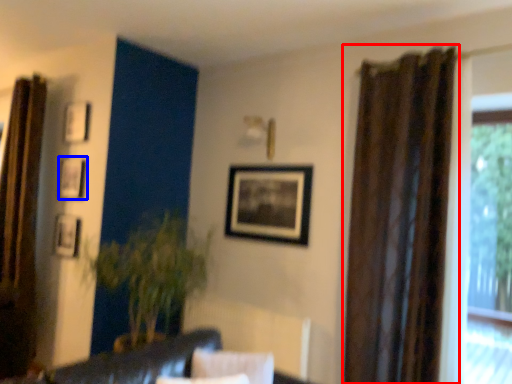
Question: Which of the following is the farthest to the observer, curtain (highlighted by a red box) or picture frame (highlighted by a blue box)?

Choices:
 (A) curtain
 (B) picture frame

Answer: (B)